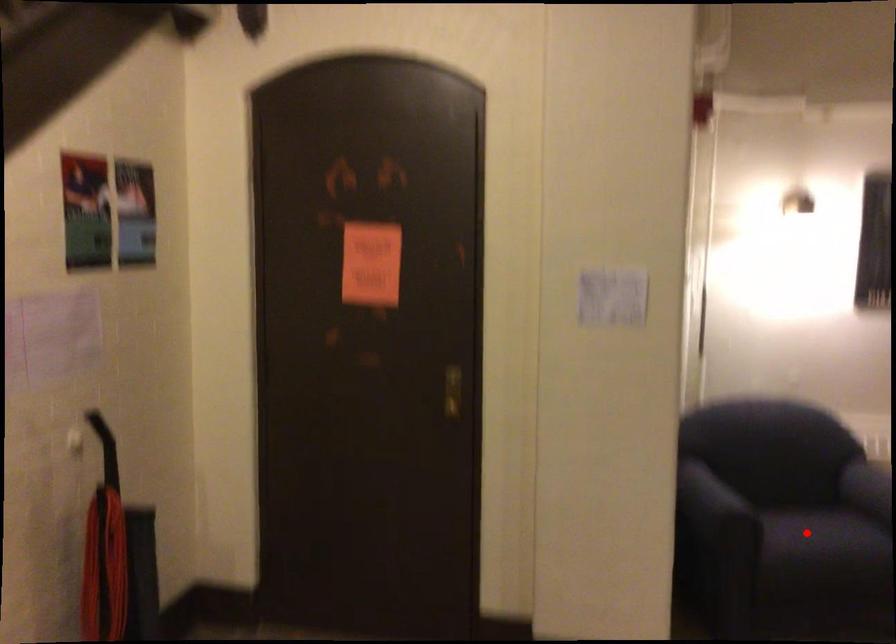
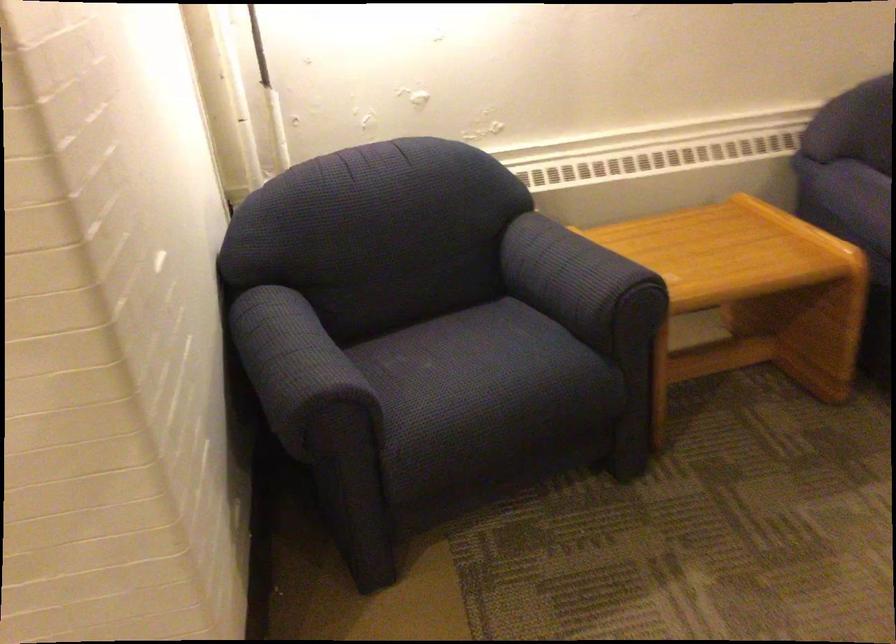
Question: I am providing you with two images of the same scene from different viewpoints. A red point is shown in image1. For the corresponding object point in image2, is it positioned nearer or farther from the camera?

Choices:
 (A) Nearer
 (B) Farther

Answer: (A)